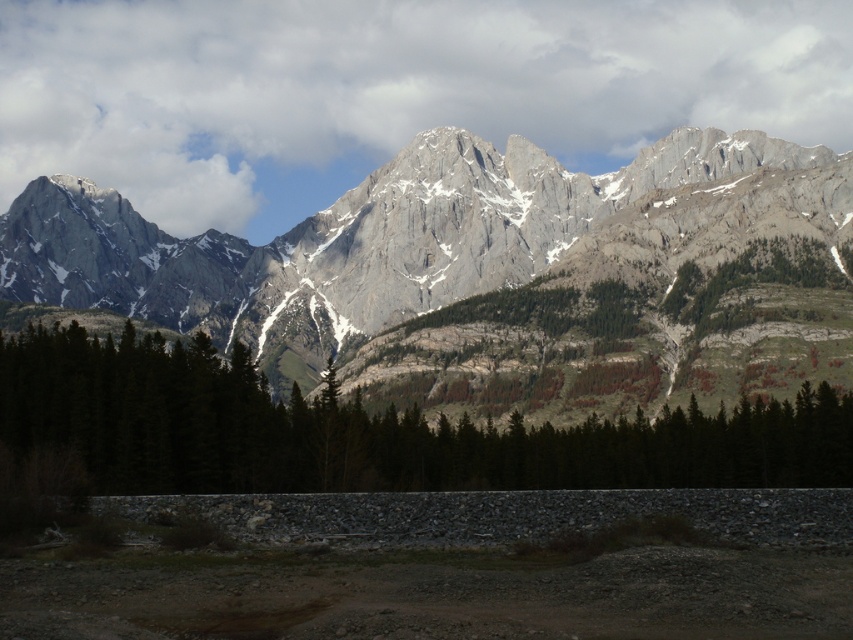
Which is more to the right, gray rocky mountain range at upper center or green matte trees at center?

Positioned to the right is green matte trees at center.

Is gray rocky mountain range at upper center bigger than green matte trees at center?

Yes.

This screenshot has width=853, height=640. What do you see at coordinates (505, 275) in the screenshot?
I see `gray rocky mountain range at upper center` at bounding box center [505, 275].

Locate an element on the screen. This screenshot has height=640, width=853. gray rocky mountain range at upper center is located at coordinates [505, 275].